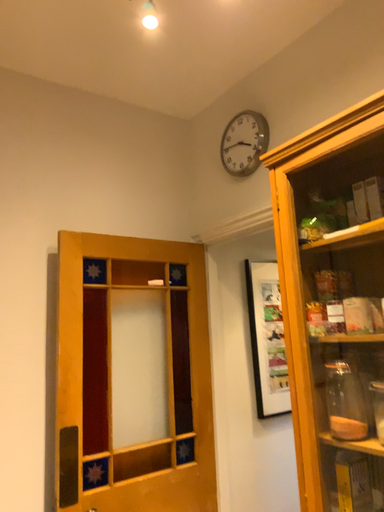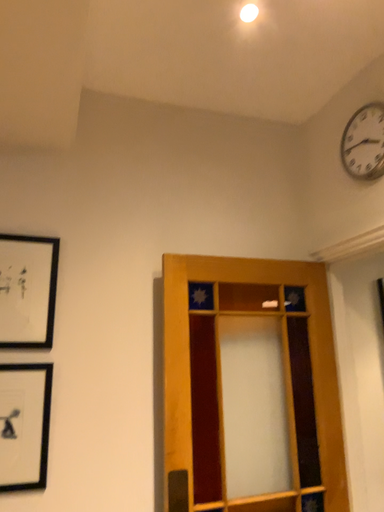
Question: Which way did the camera rotate in the video?

Choices:
 (A) rotated right
 (B) rotated left

Answer: (B)